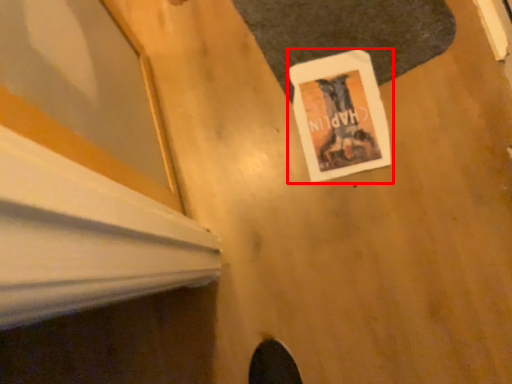
Question: From the image's perspective, where is poster page (annotated by the red box) located relative to mat?

Choices:
 (A) below
 (B) above

Answer: (A)